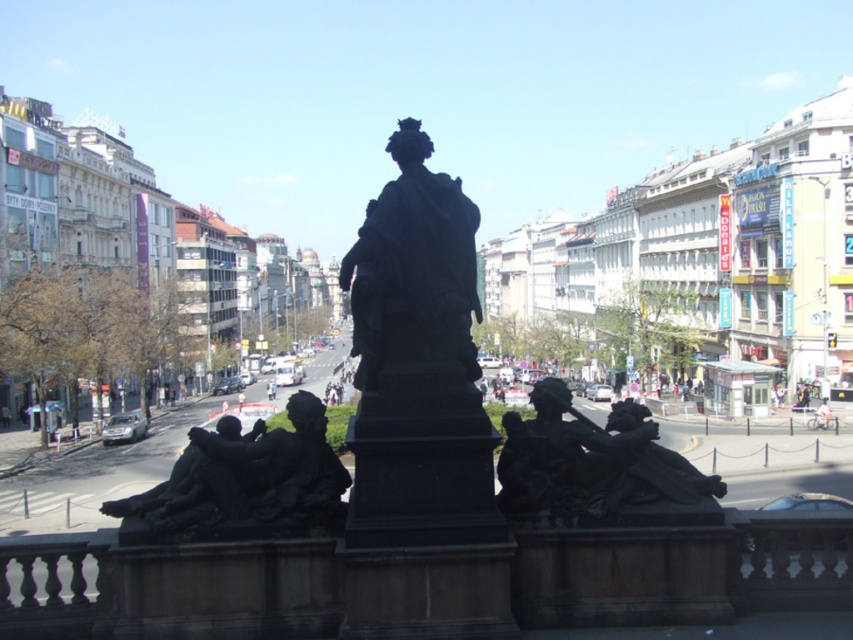
You are a photographer standing at the edge of the city square. You want to capture a photo that includes both the black polished statue at center and the light blue fabric person at lower right. Which object should you position closer to the front of the frame to ensure both are visible in the photo?

You should position the light blue fabric person at lower right closer to the front of the frame because the black polished statue at center is taller than the light blue fabric person at lower right, so placing the shorter object closer will help balance the composition and ensure both are visible.

You are standing in the middle of the city square and see the black polished statue at center. If you face directly north, will the statue be to your left or right?

The black polished statue at center is located at coordinates approximately 0.575 on the x axis and 0.494 on the y axis. Since the statue is positioned slightly to the right of the central point, if you face north, the statue would be to your right side.